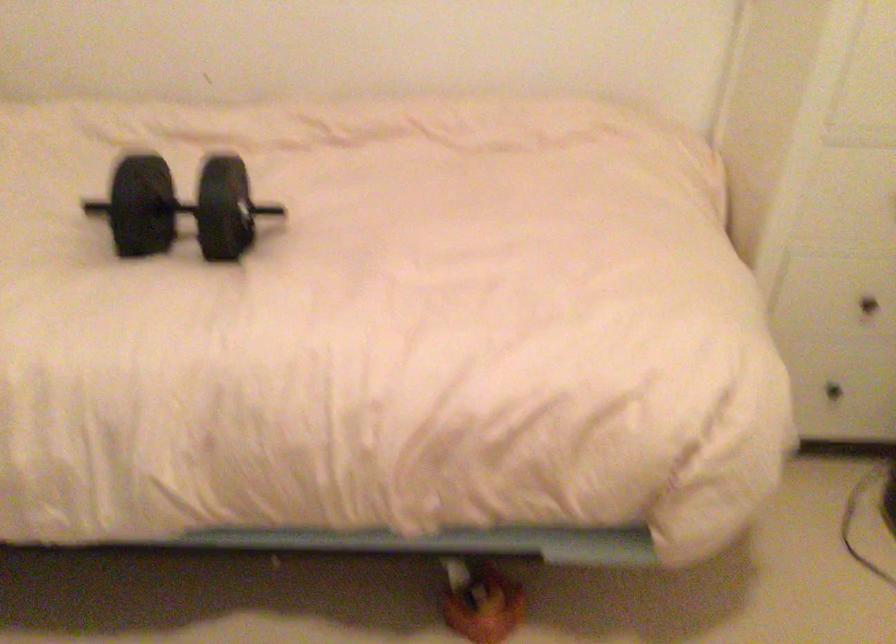
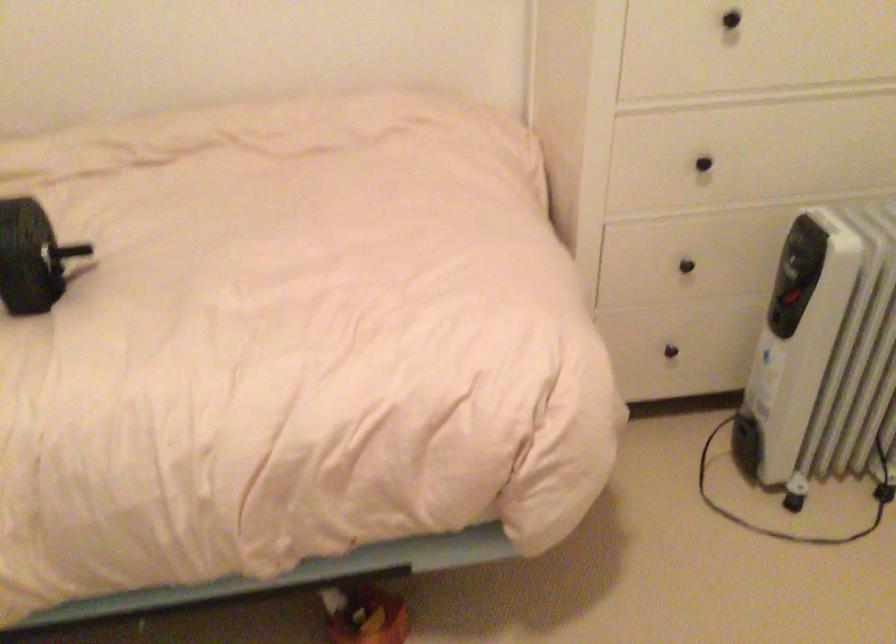
Question: What movement of the cameraman would produce the second image?

Choices:
 (A) Left
 (B) Right
 (C) Forward
 (D) Backward

Answer: (B)